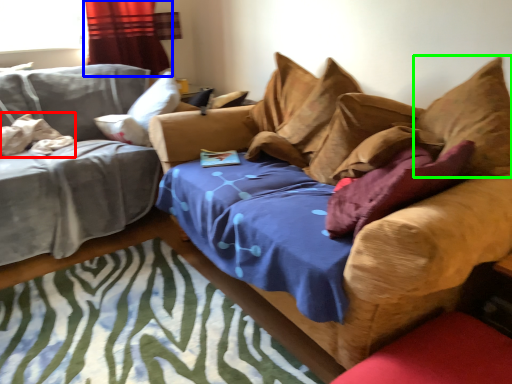
Question: Estimate the real-world distances between objects in this image. Which object is closer to pillow (highlighted by a red box), curtain (highlighted by a blue box) or pillow (highlighted by a green box)?

Choices:
 (A) curtain
 (B) pillow

Answer: (A)